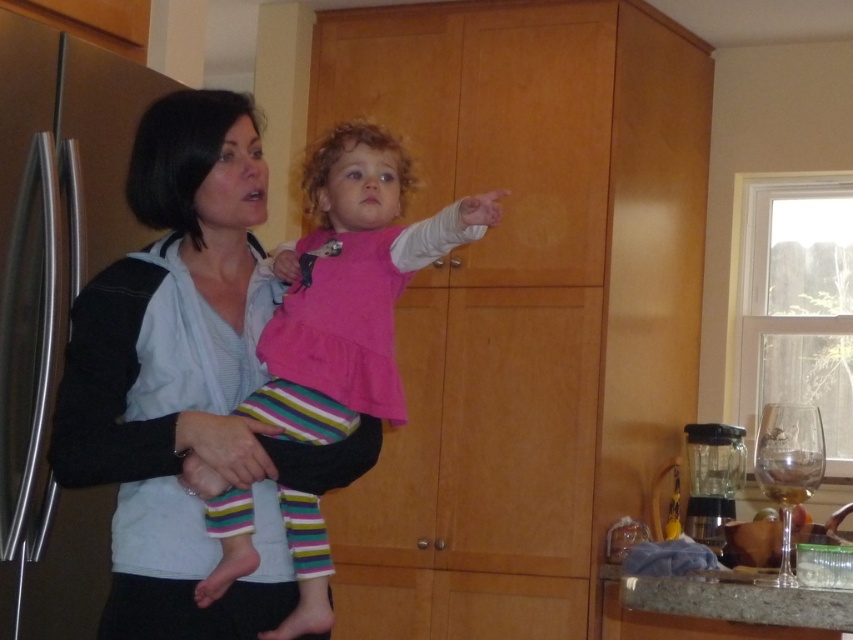
You are standing in the kitchen and want to reach the point at coordinates (216,280). If your arm can extend 1.5 meters, can you comfortably reach that point without moving?

The distance of point (216,280) from the viewer is 1.84 meters, so you cannot comfortably reach it with an arm extension of 1.5 meters. You need to move closer.

You are a delivery person who just arrived at the house. You need to place a package on the matte black sweater at center. Can you reach it from your current position? The package is 1 meter in length.

The distance of matte black sweater at center from camera is 1.56 meters. Since the package is 1 meter long, you can reach it as the distance is greater than the package length.

You are a home safety inspector checking the kitchen layout. The pink fabric baby at center and the granite countertop at lower right are in the scene. Considering the size difference between them, which object might pose a tripping hazard if placed in a narrow hallway?

The pink fabric baby at center is wider than the granite countertop at lower right, so it might pose a tripping hazard in a narrow hallway due to its larger size.